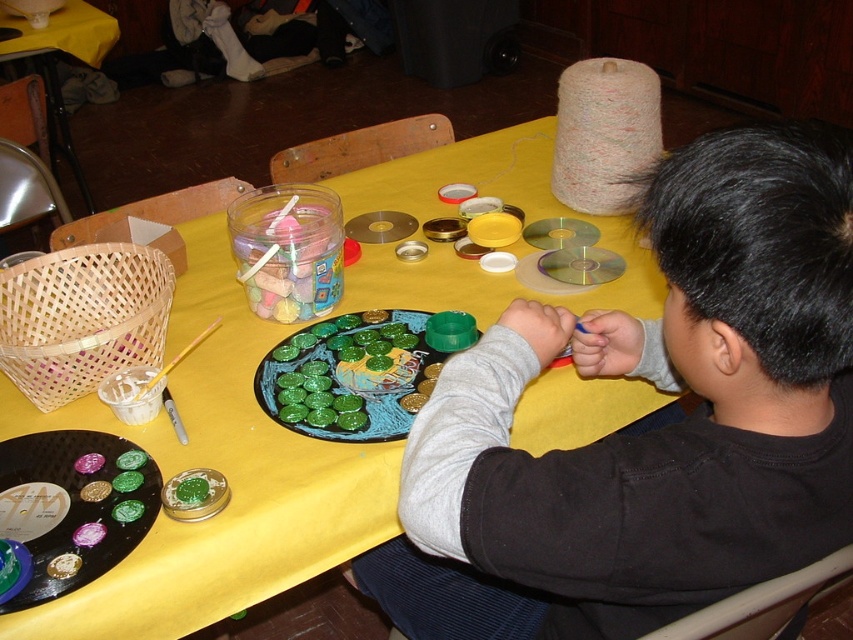
Question: Which point appears farthest from the camera in this image?

Choices:
 (A) (93, 17)
 (B) (787, 419)
 (C) (61, 577)

Answer: (A)

Question: Can you confirm if black matte shirt at upper right is positioned below yellow fabric table at center?

Choices:
 (A) no
 (B) yes

Answer: (B)

Question: Which point appears farthest from the camera in this image?

Choices:
 (A) (372, 340)
 (B) (106, 540)
 (C) (50, 563)

Answer: (A)

Question: Does black matte shirt at upper right come in front of green matte paint at center?

Choices:
 (A) yes
 (B) no

Answer: (A)

Question: Does green matte vinyl record at center have a larger size compared to green matte paint at center?

Choices:
 (A) no
 (B) yes

Answer: (B)

Question: Which object is positioned farthest from the green matte vinyl record at center?

Choices:
 (A) green glossy plate at center
 (B) yellow fabric table at lower left

Answer: (B)